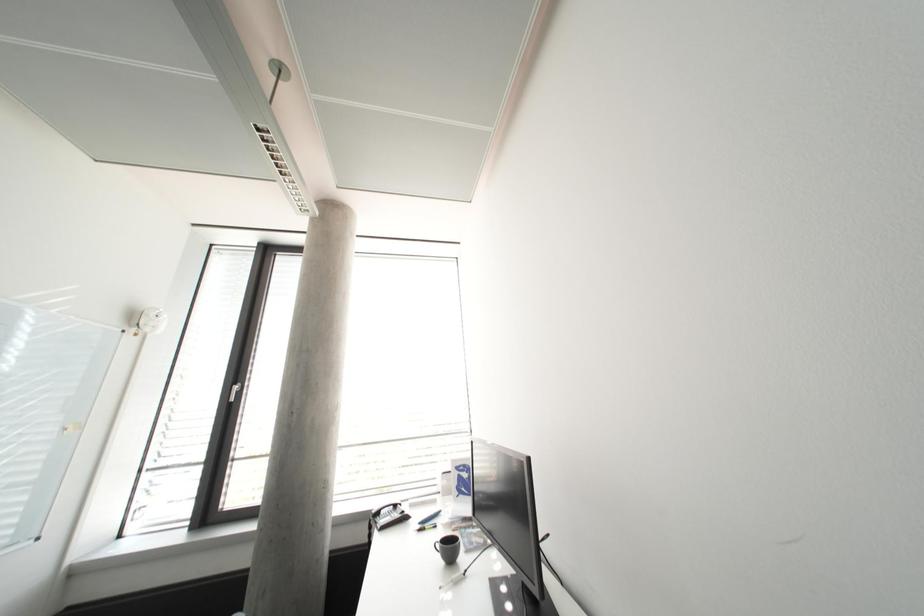
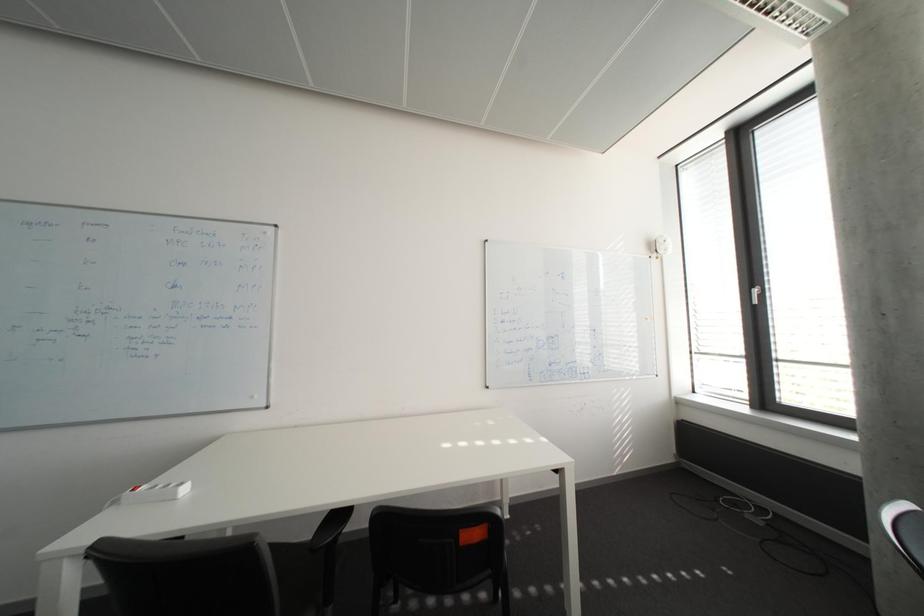
Question: Based on the continuous images, in which direction is the camera rotating? Reply with the corresponding letter.

Choices:
 (A) Left
 (B) Right
 (C) Up
 (D) Down

Answer: (A)